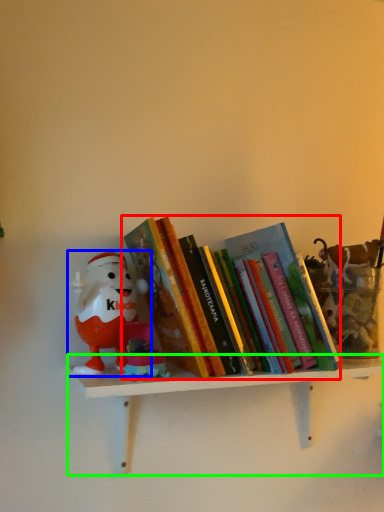
Question: Estimate the real-world distances between objects in this image. Which object is farther from book (highlighted by a red box), toy (highlighted by a blue box) or shelf (highlighted by a green box)?

Choices:
 (A) toy
 (B) shelf

Answer: (B)